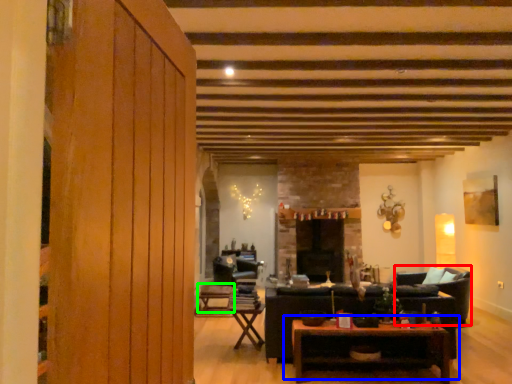
Question: Estimate the real-world distances between objects in this image. Which object is closer to armchair (highlighted by a red box), table (highlighted by a blue box) or table (highlighted by a green box)?

Choices:
 (A) table
 (B) table

Answer: (A)